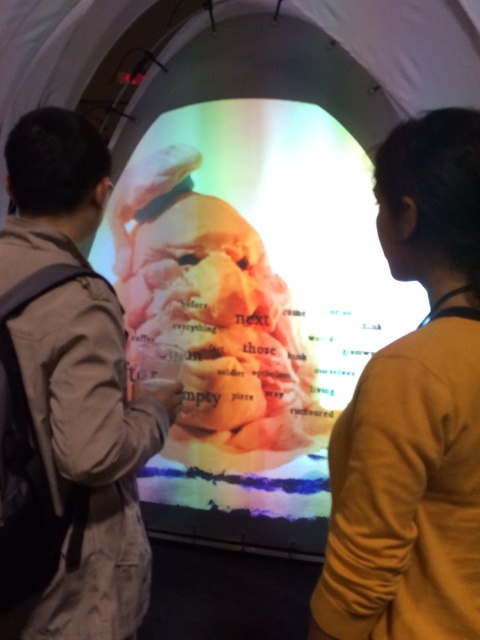
Is translucent plastic face at center to the left of khaki cotton jacket at left from the viewer's perspective?

Incorrect, translucent plastic face at center is not on the left side of khaki cotton jacket at left.

Does translucent plastic face at center lie behind khaki cotton jacket at left?

Yes, translucent plastic face at center is behind khaki cotton jacket at left.

Where is `translucent plastic face at center`? Image resolution: width=480 pixels, height=640 pixels. translucent plastic face at center is located at coordinates (252, 308).

Is point (276, 476) positioned before point (453, 237)?

That is False.

Is translucent plastic face at center below orange sweater at center?

No.

Who is more forward, (223, 337) or (400, 509)?

Point (400, 509) is in front.

Locate an element on the screen. translucent plastic face at center is located at coordinates (252, 308).

Between orange sweater at center and khaki cotton jacket at left, which one appears on the left side from the viewer's perspective?

khaki cotton jacket at left

Is point (358, 436) positioned before point (66, 221)?

Yes, point (358, 436) is in front of point (66, 221).

Is point (466, 177) farther from camera compared to point (32, 342)?

No, it is not.

You are a GUI agent. You are given a task and a screenshot of the screen. Output one action in this format:
    pyautogui.click(x=<x>, y=<y>)
    Task: Click on the orange sweater at center
    
    Given the screenshot: What is the action you would take?
    pyautogui.click(x=414, y=412)